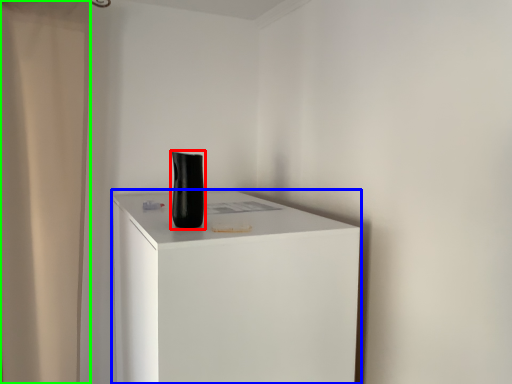
Question: Considering the real-world distances, which object is closest to vase (highlighted by a red box)? furniture (highlighted by a blue box) or shower curtain (highlighted by a green box).

Choices:
 (A) furniture
 (B) shower curtain

Answer: (A)